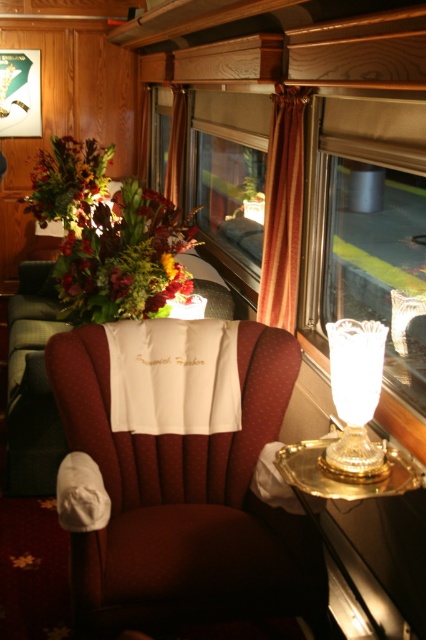
Question: Can you confirm if transparent glass window at center is positioned below orange fabric curtain at center?

Choices:
 (A) yes
 (B) no

Answer: (A)

Question: Which object is farther from the camera taking this photo?

Choices:
 (A) satin burgundy armchair at center
 (B) multicolored floral arrangement at left

Answer: (B)

Question: Can you confirm if satin burgundy armchair at center is smaller than multicolored floral bouquet at center?

Choices:
 (A) no
 (B) yes

Answer: (B)

Question: Which point is closer to the camera taking this photo?

Choices:
 (A) (175, 115)
 (B) (135, 230)

Answer: (B)

Question: Does multicolored floral bouquet at center have a lesser width compared to gold metallic tray at lower right?

Choices:
 (A) no
 (B) yes

Answer: (A)

Question: Which of these objects is positioned closest to the transparent glass vase at right?

Choices:
 (A) orange fabric curtain at upper center
 (B) orange velvet curtain at center
 (C) gold metallic tray at lower right
 (D) orange fabric curtain at center

Answer: (B)